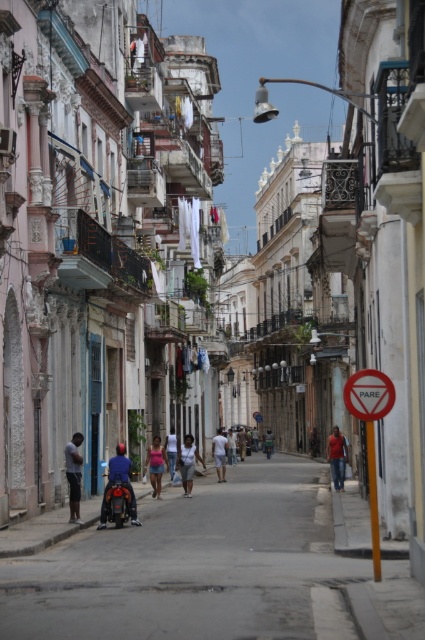
Between light gray cotton shirt at center and white cotton shirt at center, which one appears on the right side from the viewer's perspective?

From the viewer's perspective, white cotton shirt at center appears more on the right side.

Who is shorter, light gray cotton shirt at center or white cotton shirt at center?

Standing shorter between the two is light gray cotton shirt at center.

Does point (178, 454) come in front of point (220, 474)?

That is True.

Locate an element on the screen. light gray cotton shirt at center is located at coordinates (187, 464).

Which is below, dark gray shirt at center or green fabric shirt at center?

green fabric shirt at center is lower down.

Does dark gray shirt at center have a smaller size compared to green fabric shirt at center?

Correct, dark gray shirt at center occupies less space than green fabric shirt at center.

Does point (67, 458) lie in front of point (266, 442)?

Yes, it is.

Where is `dark gray shirt at center`? dark gray shirt at center is located at coordinates pyautogui.click(x=73, y=474).

Is dark gray shirt at center wider than light blue jeans at center?

Incorrect, dark gray shirt at center's width does not surpass light blue jeans at center's.

Between point (78, 518) and point (235, 442), which one is positioned behind?

The point (235, 442) is more distant.

What do you see at coordinates (73, 474) in the screenshot? Image resolution: width=425 pixels, height=640 pixels. I see `dark gray shirt at center` at bounding box center [73, 474].

Where is `dark gray shirt at center`? dark gray shirt at center is located at coordinates (73, 474).